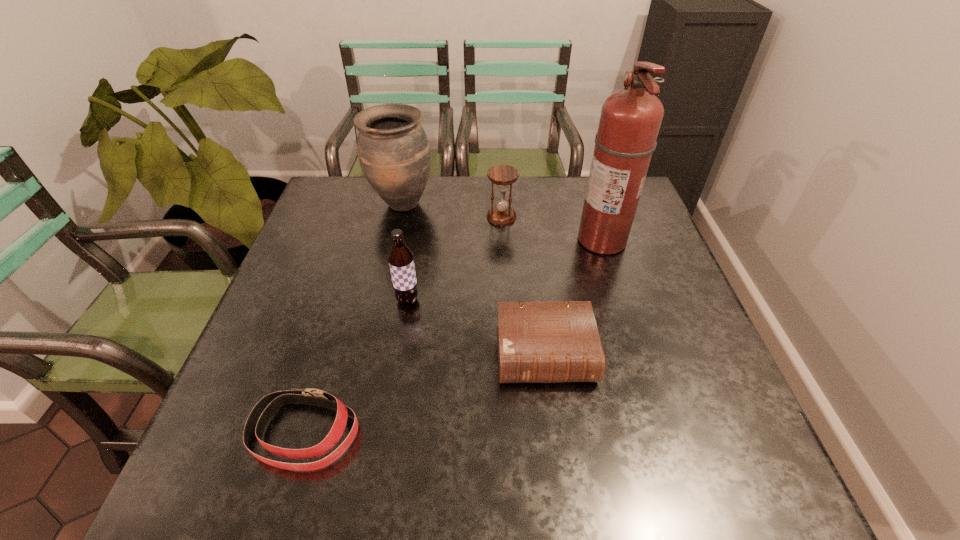
Identify the location of hourglass located at the far edge. The width and height of the screenshot is (960, 540). (501, 214).

Locate an element on the screen. The image size is (960, 540). object that is at the near edge is located at coordinates (263, 411).

In order to click on urn that is at the left edge in this screenshot , I will do `click(394, 154)`.

This screenshot has width=960, height=540. What are the coordinates of `dog collar that is at the left edge` in the screenshot? It's located at (263, 411).

Where is `object located at the right edge`? This screenshot has height=540, width=960. object located at the right edge is located at coordinates (630, 120).

You are a GUI agent. You are given a task and a screenshot of the screen. Output one action in this format:
    pyautogui.click(x=<x>, y=<y>)
    Task: Click on the object situated at the far left corner
    The width and height of the screenshot is (960, 540).
    Given the screenshot: What is the action you would take?
    pyautogui.click(x=394, y=154)

Locate an element on the screen. This screenshot has height=540, width=960. object located in the near left corner section of the desktop is located at coordinates (263, 411).

Where is `object situated at the far right corner`? object situated at the far right corner is located at coordinates (630, 120).

Find the location of a particular element. The width and height of the screenshot is (960, 540). vacant space at the far edge of the desktop is located at coordinates (457, 204).

The image size is (960, 540). What are the coordinates of `vacant region at the near edge of the desktop` in the screenshot? It's located at (392, 479).